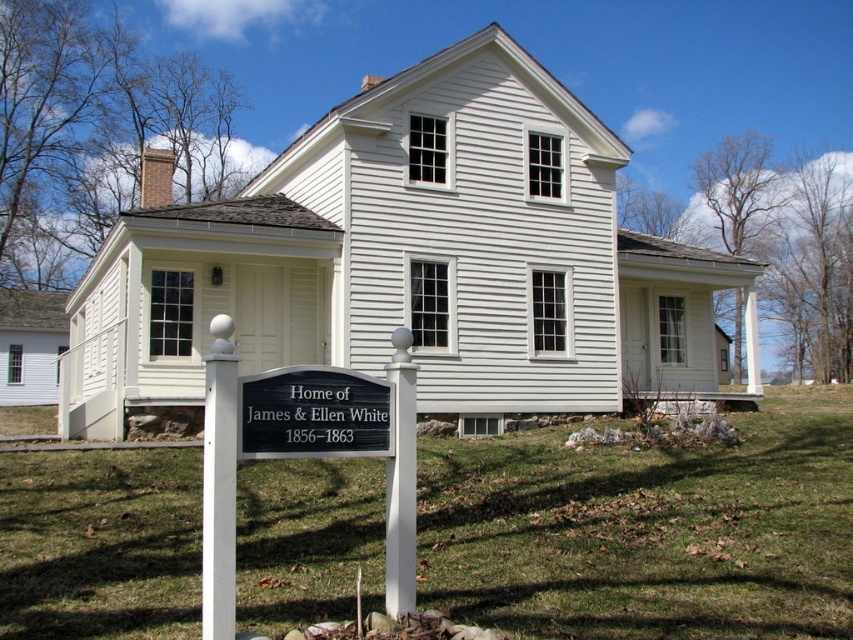
Question: From the image, what is the correct spatial relationship of white siding house at center in relation to black metal sign at lower center?

Choices:
 (A) left
 (B) right

Answer: (A)

Question: Which object is the farthest from the black metal sign at lower center?

Choices:
 (A) white siding house at center
 (B) black polished sign at center

Answer: (A)

Question: Does white siding house at center appear over black polished sign at center?

Choices:
 (A) no
 (B) yes

Answer: (B)

Question: Which point appears farthest from the camera in this image?

Choices:
 (A) (323, 392)
 (B) (102, 324)

Answer: (B)

Question: Which point appears closest to the camera in this image?

Choices:
 (A) (343, 392)
 (B) (398, 330)
 (C) (106, 285)

Answer: (A)

Question: Can you confirm if white siding house at center is bigger than black metal sign at lower center?

Choices:
 (A) yes
 (B) no

Answer: (A)